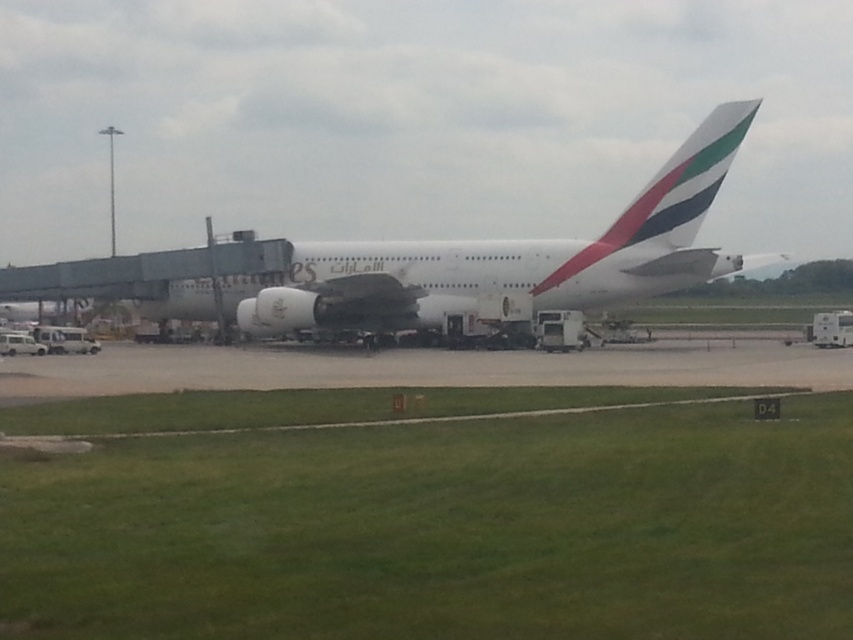
Question: Is white glossy tail at center thinner than metallic silver jet engine at center?

Choices:
 (A) no
 (B) yes

Answer: (A)

Question: Which of the following is the farthest from the observer?

Choices:
 (A) (624, 234)
 (B) (393, 310)

Answer: (B)

Question: Does white glossy tail at center have a larger size compared to metallic silver jet engine at center?

Choices:
 (A) no
 (B) yes

Answer: (B)

Question: Which object appears farthest from the camera in this image?

Choices:
 (A) white glossy tail at center
 (B) white glossy airplane at center

Answer: (B)

Question: Does white glossy airplane at center have a greater width compared to metallic silver jet engine at center?

Choices:
 (A) no
 (B) yes

Answer: (B)

Question: Considering the real-world distances, which object is closest to the metallic silver jet engine at center?

Choices:
 (A) white glossy airplane at center
 (B) white glossy tail at center

Answer: (A)